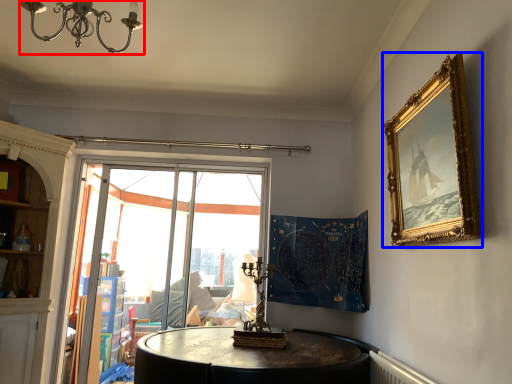
Question: Which object appears closest to the camera in this image, light fixture (highlighted by a red box) or picture frame (highlighted by a blue box)?

Choices:
 (A) light fixture
 (B) picture frame

Answer: (A)